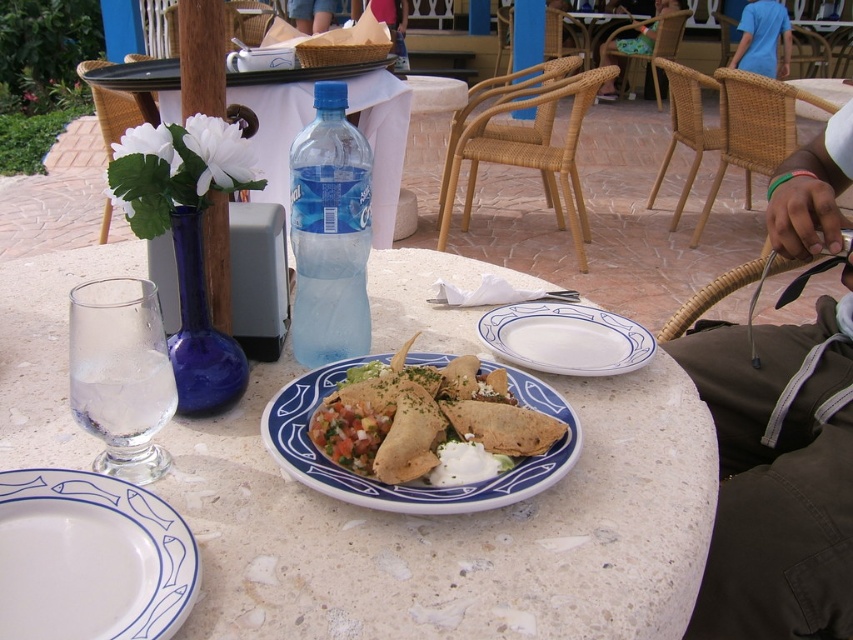
Is white marble plate at center thinner than brown fabric pants at lower right?

In fact, white marble plate at center might be wider than brown fabric pants at lower right.

Locate an element on the screen. The height and width of the screenshot is (640, 853). white marble plate at center is located at coordinates (457, 531).

Locate an element on the screen. This screenshot has height=640, width=853. white marble plate at center is located at coordinates (457, 531).

Is white marble plate at center positioned before blue cotton shirt at upper right?

That is True.

The height and width of the screenshot is (640, 853). Describe the element at coordinates (457, 531) in the screenshot. I see `white marble plate at center` at that location.

Find the location of a particular element. white marble plate at center is located at coordinates (457, 531).

Who is positioned more to the right, clear glass at center or white ceramic plate at center?

From the viewer's perspective, white ceramic plate at center appears more on the right side.

Is clear glass at center smaller than white ceramic plate at center?

Yes.

This screenshot has width=853, height=640. What do you see at coordinates (120, 374) in the screenshot? I see `clear glass at center` at bounding box center [120, 374].

The image size is (853, 640). Identify the location of clear glass at center. (120, 374).